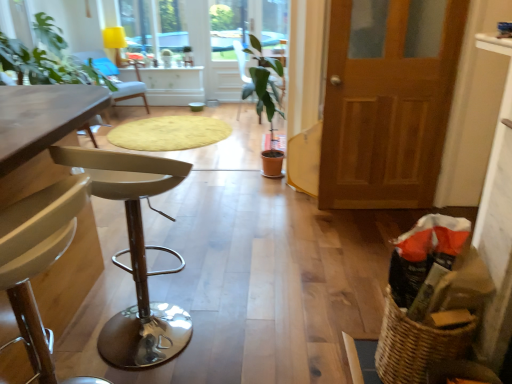
Identify the location of free space between metallic silver stool at left, the second chair when ordered from left to right, and woven brown basket at lower right. (278, 340).